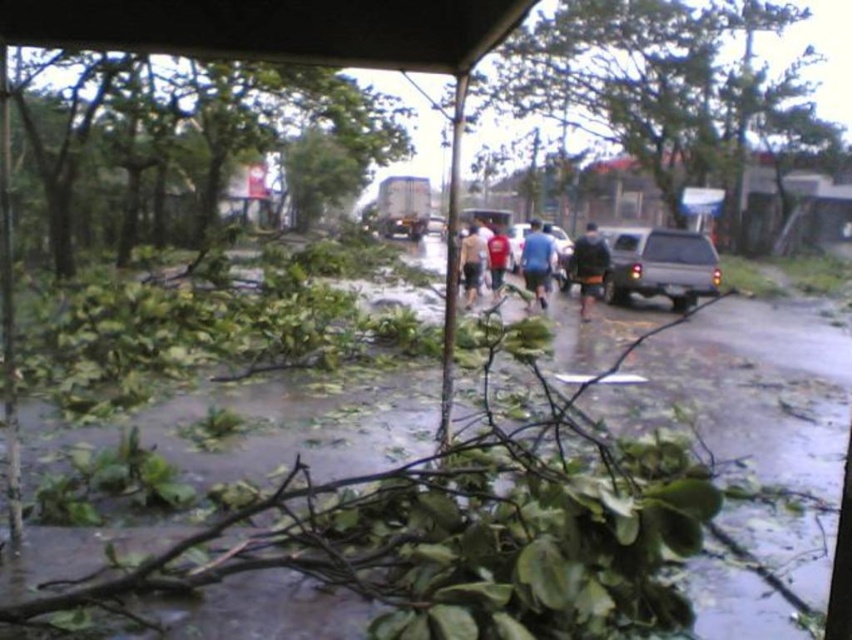
Question: Which of the following is the closest to the observer?

Choices:
 (A) red matte shirt at center
 (B) green leafy tree at left
 (C) blue fabric shirt at center
 (D) matte blue car at center

Answer: (B)

Question: Which object is positioned closest to the matte gray truck at center?

Choices:
 (A) blue fabric shirt at center
 (B) green leafy debris at center
 (C) dark blue jacket at center

Answer: (A)

Question: Can you confirm if green leafy tree at upper center is smaller than matte gray truck at center?

Choices:
 (A) no
 (B) yes

Answer: (A)

Question: Where is matte gray truck at center located in relation to matte blue car at center in the image?

Choices:
 (A) below
 (B) above

Answer: (A)

Question: Is dark blue jacket at center closer to camera compared to dark brown fabric pants at center?

Choices:
 (A) yes
 (B) no

Answer: (A)

Question: Which is farther from the green leafy debris at center?

Choices:
 (A) blue fabric shirt at center
 (B) dark blue jacket at center
 (C) matte blue car at center
 (D) green leafy tree at left

Answer: (D)